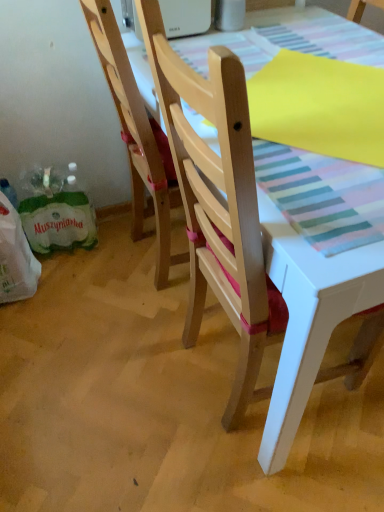
Where is `green plastic grocery bag at lower left`? This screenshot has height=512, width=384. green plastic grocery bag at lower left is located at coordinates (15, 257).

Identify the location of natural wood chair at center, the 1th chair when ordered from left to right. This screenshot has width=384, height=512. (137, 137).

Find the location of a particular element. The image size is (384, 512). green paper shopping bag at lower left is located at coordinates (56, 210).

Does green plastic grocery bag at lower left appear on the right side of natural wood chair at center, arranged as the second chair when viewed from the right?

Incorrect, green plastic grocery bag at lower left is not on the right side of natural wood chair at center, arranged as the second chair when viewed from the right.

Considering the sizes of green plastic grocery bag at lower left and natural wood chair at center, arranged as the second chair when viewed from the right, in the image, is green plastic grocery bag at lower left taller or shorter than natural wood chair at center, arranged as the second chair when viewed from the right,?

green plastic grocery bag at lower left is shorter than natural wood chair at center, arranged as the second chair when viewed from the right.

The height and width of the screenshot is (512, 384). Identify the location of grocery bag behind the natural wood chair at center, arranged as the second chair when viewed from the right. (15, 257).

Consider the image. Which of these two, green plastic grocery bag at lower left or natural wood chair at center, the 1th chair when ordered from left to right, is bigger?

With larger size is natural wood chair at center, the 1th chair when ordered from left to right.

Considering the sizes of objects wooden chair at center, the second chair when ordered from left to right, and green paper shopping bag at lower left in the image provided, who is shorter, wooden chair at center, the second chair when ordered from left to right, or green paper shopping bag at lower left?

green paper shopping bag at lower left.

Is wooden chair at center, acting as the first chair starting from the right, inside or outside of green paper shopping bag at lower left?

The correct answer is: outside.

Based on the photo, from a real-world perspective, is wooden chair at center, the second chair when ordered from left to right, located beneath green paper shopping bag at lower left?

No, from a real-world perspective, wooden chair at center, the second chair when ordered from left to right, is not under green paper shopping bag at lower left.

Is wooden chair at center, acting as the first chair starting from the right, facing away from green paper shopping bag at lower left?

No, wooden chair at center, acting as the first chair starting from the right, is not facing the opposite direction of green paper shopping bag at lower left.

Locate an element on the screen. chair lying above the green paper shopping bag at lower left (from the image's perspective) is located at coordinates (137, 137).

Which object is further away from the camera taking this photo, natural wood chair at center, arranged as the second chair when viewed from the right, or green paper shopping bag at lower left?

green paper shopping bag at lower left is more distant.

From a real-world perspective, who is located lower, natural wood chair at center, the 1th chair when ordered from left to right, or green paper shopping bag at lower left?

green paper shopping bag at lower left.

Considering the relative sizes of natural wood chair at center, arranged as the second chair when viewed from the right, and green paper shopping bag at lower left in the image provided, is natural wood chair at center, arranged as the second chair when viewed from the right, bigger than green paper shopping bag at lower left?

Correct, natural wood chair at center, arranged as the second chair when viewed from the right, is larger in size than green paper shopping bag at lower left.

Find the location of a particular element. The width and height of the screenshot is (384, 512). chair above the natural wood chair at center, the 1th chair when ordered from left to right (from a real-world perspective) is located at coordinates (256, 247).

Which is nearer, (104,24) or (214,106)?

Point (104,24) is farther from the camera than point (214,106).

Can you confirm if natural wood chair at center, the 1th chair when ordered from left to right, is thinner than wooden chair at center, the second chair when ordered from left to right?

Correct, the width of natural wood chair at center, the 1th chair when ordered from left to right, is less than that of wooden chair at center, the second chair when ordered from left to right.

Is natural wood chair at center, arranged as the second chair when viewed from the right, to the right of wooden chair at center, the second chair when ordered from left to right, from the viewer's perspective?

Incorrect, natural wood chair at center, arranged as the second chair when viewed from the right, is not on the right side of wooden chair at center, the second chair when ordered from left to right.

From the image's perspective, is natural wood chair at center, arranged as the second chair when viewed from the right, under green plastic grocery bag at lower left?

No, from the image's perspective, natural wood chair at center, arranged as the second chair when viewed from the right, is not below green plastic grocery bag at lower left.

Which chair is the 1st one when counting from the front of the green plastic grocery bag at lower left? Please provide its 2D coordinates.

[(137, 137)]

Based on the photo, measure the distance between natural wood chair at center, arranged as the second chair when viewed from the right, and green plastic grocery bag at lower left.

natural wood chair at center, arranged as the second chair when viewed from the right, is 20.31 inches away from green plastic grocery bag at lower left.

Can you confirm if wooden chair at center, the second chair when ordered from left to right, is positioned to the right of natural wood chair at center, the 1th chair when ordered from left to right?

Indeed, wooden chair at center, the second chair when ordered from left to right, is positioned on the right side of natural wood chair at center, the 1th chair when ordered from left to right.

Which is in front, point (154, 64) or point (149, 160)?

Positioned in front is point (154, 64).

From the image's perspective, relative to natural wood chair at center, the 1th chair when ordered from left to right, is wooden chair at center, the second chair when ordered from left to right, above or below?

From the image's perspective, wooden chair at center, the second chair when ordered from left to right, appears below natural wood chair at center, the 1th chair when ordered from left to right.

Is wooden chair at center, acting as the first chair starting from the right, oriented towards natural wood chair at center, arranged as the second chair when viewed from the right?

No, wooden chair at center, acting as the first chair starting from the right, is not aimed at natural wood chair at center, arranged as the second chair when viewed from the right.

Looking at the image, does green paper shopping bag at lower left seem bigger or smaller compared to green plastic grocery bag at lower left?

Considering their sizes, green paper shopping bag at lower left takes up more space than green plastic grocery bag at lower left.

Is point (30, 223) behind point (19, 236)?

Yes, it is.

Based on the photo, can you tell me how much green paper shopping bag at lower left and green plastic grocery bag at lower left differ in facing direction?

The angle between the facing direction of green paper shopping bag at lower left and the facing direction of green plastic grocery bag at lower left is 12.6 degrees.

Identify the location of the 1st chair counting from the right side of the green plastic grocery bag at lower left. (137, 137).

Locate an element on the screen. chair below the green paper shopping bag at lower left (from the image's perspective) is located at coordinates (256, 247).

Estimate the real-world distances between objects in this image. Which object is further from green paper shopping bag at lower left, green plastic grocery bag at lower left or wooden chair at center, acting as the first chair starting from the right?

wooden chair at center, acting as the first chair starting from the right, is further to green paper shopping bag at lower left.

Based on their spatial positions, is green paper shopping bag at lower left or green plastic grocery bag at lower left closer to wooden chair at center, acting as the first chair starting from the right?

Based on the image, green paper shopping bag at lower left appears to be nearer to wooden chair at center, acting as the first chair starting from the right.

Considering their positions, is wooden chair at center, the second chair when ordered from left to right, positioned further to natural wood chair at center, the 1th chair when ordered from left to right, than green plastic grocery bag at lower left?

green plastic grocery bag at lower left is further to natural wood chair at center, the 1th chair when ordered from left to right.

From the image, which object appears to be nearer to wooden chair at center, acting as the first chair starting from the right, natural wood chair at center, arranged as the second chair when viewed from the right, or green plastic grocery bag at lower left?

natural wood chair at center, arranged as the second chair when viewed from the right, is closer to wooden chair at center, acting as the first chair starting from the right.

Which object lies further to the anchor point wooden chair at center, acting as the first chair starting from the right, green plastic grocery bag at lower left or green paper shopping bag at lower left?

green plastic grocery bag at lower left is further to wooden chair at center, acting as the first chair starting from the right.

When comparing their distances from green paper shopping bag at lower left, does natural wood chair at center, the 1th chair when ordered from left to right, or green plastic grocery bag at lower left seem closer?

green plastic grocery bag at lower left is closer to green paper shopping bag at lower left.

When comparing their distances from natural wood chair at center, the 1th chair when ordered from left to right, does green plastic grocery bag at lower left or wooden chair at center, acting as the first chair starting from the right, seem closer?

Among the two, wooden chair at center, acting as the first chair starting from the right, is located nearer to natural wood chair at center, the 1th chair when ordered from left to right.

Estimate the real-world distances between objects in this image. Which object is closer to natural wood chair at center, the 1th chair when ordered from left to right, green paper shopping bag at lower left or green plastic grocery bag at lower left?

Based on the image, green paper shopping bag at lower left appears to be nearer to natural wood chair at center, the 1th chair when ordered from left to right.

I want to click on chair between green plastic grocery bag at lower left and wooden chair at center, the second chair when ordered from left to right, so click(137, 137).

The height and width of the screenshot is (512, 384). Find the location of `chair between wooden chair at center, acting as the first chair starting from the right, and green paper shopping bag at lower left, along the z-axis`. chair between wooden chair at center, acting as the first chair starting from the right, and green paper shopping bag at lower left, along the z-axis is located at coordinates (137, 137).

At what (x,y) coordinates should I click in order to perform the action: click on shopping bag between green plastic grocery bag at lower left and natural wood chair at center, the 1th chair when ordered from left to right, in the horizontal direction. Please return your answer as a coordinate pair (x, y). Looking at the image, I should click on (56, 210).

Identify the location of grocery bag positioned between wooden chair at center, the second chair when ordered from left to right, and green paper shopping bag at lower left from near to far. The width and height of the screenshot is (384, 512). (15, 257).